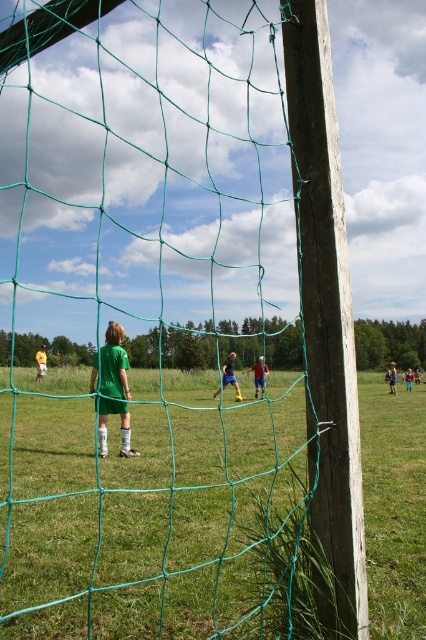
Question: Which object appears farthest from the camera in this image?

Choices:
 (A) green matte soccer player at center
 (B) green jersey boy at center

Answer: (B)

Question: Can you confirm if green matte soccer player at center is positioned above green jersey boy at center?

Choices:
 (A) no
 (B) yes

Answer: (B)

Question: Which of the following is the closest to the observer?

Choices:
 (A) (230, 365)
 (B) (123, 426)

Answer: (B)

Question: Does green matte soccer player at center appear under green jersey boy at center?

Choices:
 (A) no
 (B) yes

Answer: (A)

Question: Does green matte soccer player at center appear on the right side of green jersey boy at center?

Choices:
 (A) no
 (B) yes

Answer: (A)